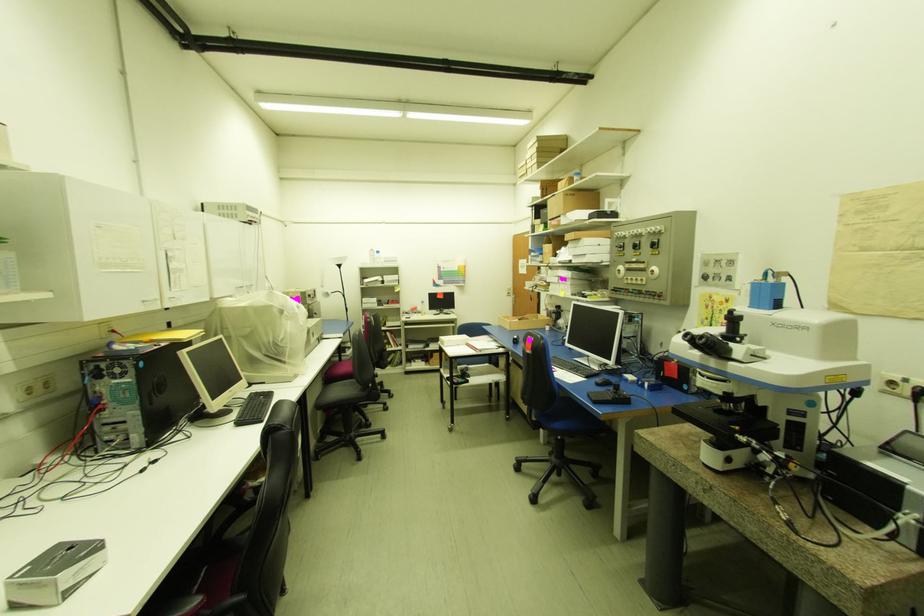
The image size is (924, 616). What do you see at coordinates (708, 344) in the screenshot?
I see `the microscope focus knob` at bounding box center [708, 344].